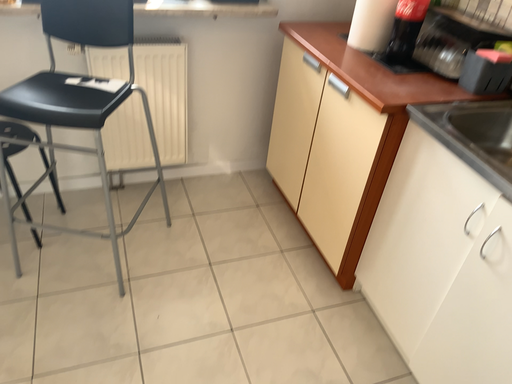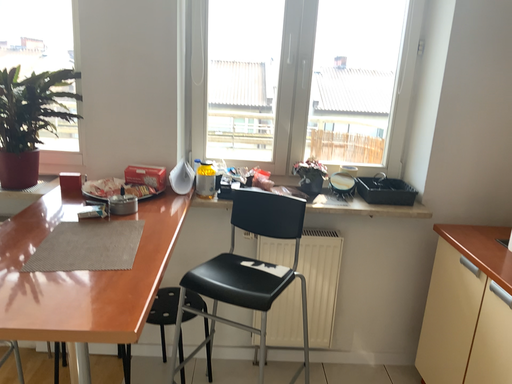
Question: Which way did the camera rotate in the video?

Choices:
 (A) rotated upward
 (B) rotated downward

Answer: (A)